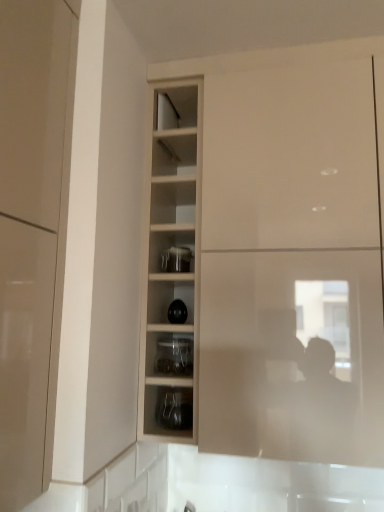
This screenshot has height=512, width=384. What do you see at coordinates (176, 259) in the screenshot?
I see `transparent glass jar at center` at bounding box center [176, 259].

In order to face matte black jar at center, the second shelf positioned from the top, should I rotate leftwards or rightwards?

Turn left by 1.677 degrees to look at matte black jar at center, the second shelf positioned from the top.

Where is `clear glass jar at center, placed as the first shelf when sorted from top to bottom`? The image size is (384, 512). clear glass jar at center, placed as the first shelf when sorted from top to bottom is located at coordinates (173, 355).

Identify the location of transparent glass jar at center. This screenshot has width=384, height=512. (176, 259).

How much distance is there between clear glass jar at center, marked as the second shelf in a bottom-to-top arrangement, and glossy beige cabinet at left, the 2th cabinetry in the back-to-front sequence?

clear glass jar at center, marked as the second shelf in a bottom-to-top arrangement, is 21.00 inches from glossy beige cabinet at left, the 2th cabinetry in the back-to-front sequence.

Which object is thinner, clear glass jar at center, marked as the second shelf in a bottom-to-top arrangement, or glossy beige cabinet at left, positioned as the second cabinetry in right-to-left order?

Thinner between the two is glossy beige cabinet at left, positioned as the second cabinetry in right-to-left order.

Considering their positions, is clear glass jar at center, marked as the second shelf in a bottom-to-top arrangement, located in front of or behind glossy beige cabinet at left, positioned as the second cabinetry in right-to-left order?

clear glass jar at center, marked as the second shelf in a bottom-to-top arrangement, is positioned farther from the viewer than glossy beige cabinet at left, positioned as the second cabinetry in right-to-left order.

Is clear glass jar at center, placed as the first shelf when sorted from top to bottom, to the left of glossy beige cabinet at left, acting as the 1th cabinetry starting from the left, from the viewer's perspective?

No, clear glass jar at center, placed as the first shelf when sorted from top to bottom, is not to the left of glossy beige cabinet at left, acting as the 1th cabinetry starting from the left.

Is matte white cabinet at center, the second cabinetry in the left-to-right sequence, shorter than matte black jar at center, acting as the 1th shelf starting from the bottom?

No, matte white cabinet at center, the second cabinetry in the left-to-right sequence, is not shorter than matte black jar at center, acting as the 1th shelf starting from the bottom.

Based on their sizes in the image, would you say matte white cabinet at center, which is the 2th cabinetry in front-to-back order, is bigger or smaller than matte black jar at center, the second shelf positioned from the top?

Clearly, matte white cabinet at center, which is the 2th cabinetry in front-to-back order, is larger in size than matte black jar at center, the second shelf positioned from the top.

Do you think matte white cabinet at center, marked as the first cabinetry in a back-to-front arrangement, is within matte black jar at center, acting as the 1th shelf starting from the bottom, or outside of it?

matte white cabinet at center, marked as the first cabinetry in a back-to-front arrangement, is not enclosed by matte black jar at center, acting as the 1th shelf starting from the bottom.

How distant is matte white cabinet at center, which is the 2th cabinetry in front-to-back order, from matte black jar at center, the second shelf positioned from the top?

A distance of 18.79 inches exists between matte white cabinet at center, which is the 2th cabinetry in front-to-back order, and matte black jar at center, the second shelf positioned from the top.

In the image, is glossy beige cabinet at left, which is the first cabinetry in front-to-back order, positioned in front of or behind clear glass jar at center, marked as the second shelf in a bottom-to-top arrangement?

Clearly, glossy beige cabinet at left, which is the first cabinetry in front-to-back order, is in front of clear glass jar at center, marked as the second shelf in a bottom-to-top arrangement.

Does glossy beige cabinet at left, positioned as the second cabinetry in right-to-left order, have a larger size compared to clear glass jar at center, marked as the second shelf in a bottom-to-top arrangement?

Yes.

Is glossy beige cabinet at left, which is the first cabinetry in front-to-back order, taller than clear glass jar at center, placed as the first shelf when sorted from top to bottom?

Correct, glossy beige cabinet at left, which is the first cabinetry in front-to-back order, is much taller as clear glass jar at center, placed as the first shelf when sorted from top to bottom.

Is glossy beige cabinet at left, which is the first cabinetry in front-to-back order, next to clear glass jar at center, placed as the first shelf when sorted from top to bottom, and touching it?

No, glossy beige cabinet at left, which is the first cabinetry in front-to-back order, is not beside clear glass jar at center, placed as the first shelf when sorted from top to bottom.

Looking at this image, which object is more forward, transparent glass jar at center or matte black jar at center, the second shelf positioned from the top?

matte black jar at center, the second shelf positioned from the top, is in front.

From a real-world perspective, relative to matte black jar at center, acting as the 1th shelf starting from the bottom, is transparent glass jar at center vertically above or below?

transparent glass jar at center is above matte black jar at center, acting as the 1th shelf starting from the bottom.

Is transparent glass jar at center oriented towards matte black jar at center, the second shelf positioned from the top?

No, transparent glass jar at center is not aimed at matte black jar at center, the second shelf positioned from the top.

Is transparent glass jar at center at the left side of matte black jar at center, acting as the 1th shelf starting from the bottom?

Correct, you'll find transparent glass jar at center to the left of matte black jar at center, acting as the 1th shelf starting from the bottom.

Which object is closer to the camera, matte black jar at center, acting as the 1th shelf starting from the bottom, or matte white cabinet at center, which is the 2th cabinetry in front-to-back order?

Positioned in front is matte white cabinet at center, which is the 2th cabinetry in front-to-back order.

From the image's perspective, which one is positioned higher, matte black jar at center, the second shelf positioned from the top, or matte white cabinet at center, the 1th cabinetry positioned from the right?

matte white cabinet at center, the 1th cabinetry positioned from the right, from the image's perspective.

Based on their sizes in the image, would you say matte black jar at center, acting as the 1th shelf starting from the bottom, is bigger or smaller than matte white cabinet at center, the 1th cabinetry positioned from the right?

In the image, matte black jar at center, acting as the 1th shelf starting from the bottom, appears to be smaller than matte white cabinet at center, the 1th cabinetry positioned from the right.

From the image's perspective, which is below, transparent glass jar at center or matte white cabinet at center, the second cabinetry in the left-to-right sequence?

From the image's view, transparent glass jar at center is below.

Is transparent glass jar at center positioned before matte white cabinet at center, the second cabinetry in the left-to-right sequence?

No, transparent glass jar at center is further to the viewer.

Between transparent glass jar at center and matte white cabinet at center, which is the 2th cabinetry in front-to-back order, which one has less height?

transparent glass jar at center is shorter.

Is transparent glass jar at center not close to matte white cabinet at center, which is the 2th cabinetry in front-to-back order?

transparent glass jar at center is near matte white cabinet at center, which is the 2th cabinetry in front-to-back order, not far away.

Is clear glass jar at center, marked as the second shelf in a bottom-to-top arrangement, far away from matte black jar at center, the second shelf positioned from the top?

They are positioned close to each other.

From the image's perspective, is clear glass jar at center, placed as the first shelf when sorted from top to bottom, located beneath matte black jar at center, acting as the 1th shelf starting from the bottom?

Incorrect, from the image's perspective, clear glass jar at center, placed as the first shelf when sorted from top to bottom, is higher than matte black jar at center, acting as the 1th shelf starting from the bottom.

Visually, is clear glass jar at center, placed as the first shelf when sorted from top to bottom, positioned to the left or to the right of matte black jar at center, the second shelf positioned from the top?

From the image, it's evident that clear glass jar at center, placed as the first shelf when sorted from top to bottom, is to the left of matte black jar at center, the second shelf positioned from the top.

Is matte black jar at center, the second shelf positioned from the top, at the back of clear glass jar at center, marked as the second shelf in a bottom-to-top arrangement?

No, clear glass jar at center, marked as the second shelf in a bottom-to-top arrangement, is not facing away from matte black jar at center, the second shelf positioned from the top.

From a real-world perspective, starting from the clear glass jar at center, marked as the second shelf in a bottom-to-top arrangement, which cabinetry is the 1st one vertically above it? Please provide its 2D coordinates.

[(32, 232)]

Identify the location of the 1st shelf behind the matte white cabinet at center, the 1th cabinetry positioned from the right, counting from the anchor's position. (168, 410).

When comparing their distances from matte white cabinet at center, which is the 2th cabinetry in front-to-back order, does clear glass jar at center, placed as the first shelf when sorted from top to bottom, or transparent glass jar at center seem further?

clear glass jar at center, placed as the first shelf when sorted from top to bottom, lies further to matte white cabinet at center, which is the 2th cabinetry in front-to-back order, than the other object.

Looking at the image, which one is located closer to matte white cabinet at center, marked as the first cabinetry in a back-to-front arrangement, glossy beige cabinet at left, positioned as the second cabinetry in right-to-left order, or matte black jar at center, acting as the 1th shelf starting from the bottom?

Among the two, matte black jar at center, acting as the 1th shelf starting from the bottom, is located nearer to matte white cabinet at center, marked as the first cabinetry in a back-to-front arrangement.

Based on their spatial positions, is clear glass jar at center, marked as the second shelf in a bottom-to-top arrangement, or transparent glass jar at center closer to wooden shelves at center?

Among the two, clear glass jar at center, marked as the second shelf in a bottom-to-top arrangement, is located nearer to wooden shelves at center.

Which object lies further to the anchor point matte white cabinet at center, the 1th cabinetry positioned from the right, transparent glass jar at center or glossy beige cabinet at left, the 2th cabinetry in the back-to-front sequence?

glossy beige cabinet at left, the 2th cabinetry in the back-to-front sequence.

Looking at the image, which one is located further to clear glass jar at center, marked as the second shelf in a bottom-to-top arrangement, wooden shelves at center or transparent glass jar at center?

transparent glass jar at center lies further to clear glass jar at center, marked as the second shelf in a bottom-to-top arrangement, than the other object.

When comparing their distances from clear glass jar at center, placed as the first shelf when sorted from top to bottom, does matte white cabinet at center, which is the 2th cabinetry in front-to-back order, or wooden shelves at center seem further?

Based on the image, matte white cabinet at center, which is the 2th cabinetry in front-to-back order, appears to be further to clear glass jar at center, placed as the first shelf when sorted from top to bottom.

From the image, which object appears to be farther from clear glass jar at center, placed as the first shelf when sorted from top to bottom, glossy beige cabinet at left, which is the first cabinetry in front-to-back order, or wooden shelves at center?

Based on the image, glossy beige cabinet at left, which is the first cabinetry in front-to-back order, appears to be further to clear glass jar at center, placed as the first shelf when sorted from top to bottom.

Based on their spatial positions, is wooden shelves at center or transparent glass jar at center closer to glossy beige cabinet at left, the 2th cabinetry in the back-to-front sequence?

wooden shelves at center.

Locate an element on the screen. The width and height of the screenshot is (384, 512). cupboard located between glossy beige cabinet at left, the 2th cabinetry in the back-to-front sequence, and transparent glass jar at center in the depth direction is located at coordinates (171, 272).

The image size is (384, 512). Identify the location of appliance between matte white cabinet at center, the 1th cabinetry positioned from the right, and matte black jar at center, acting as the 1th shelf starting from the bottom, vertically. (176, 259).

Locate an element on the screen. appliance between wooden shelves at center and clear glass jar at center, marked as the second shelf in a bottom-to-top arrangement, from top to bottom is located at coordinates (176, 259).

Image resolution: width=384 pixels, height=512 pixels. Identify the location of cupboard situated between transparent glass jar at center and matte white cabinet at center, the 1th cabinetry positioned from the right, from left to right. (171, 272).